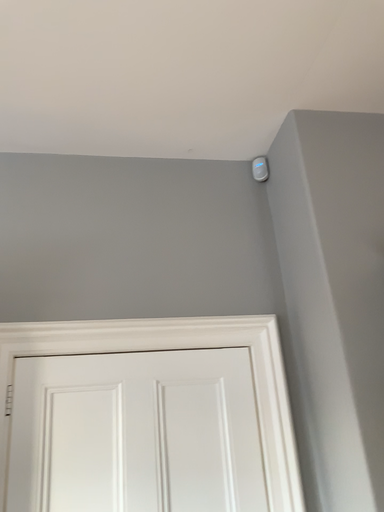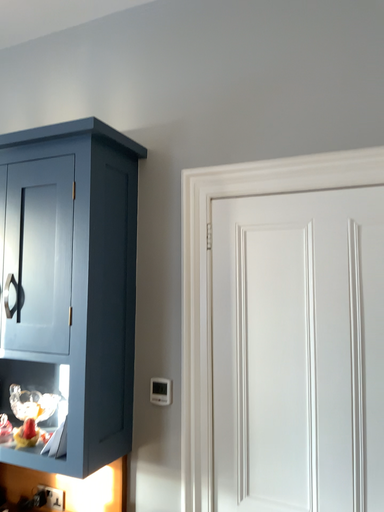
Question: How did the camera likely rotate when shooting the video?

Choices:
 (A) rotated downward
 (B) rotated upward

Answer: (A)